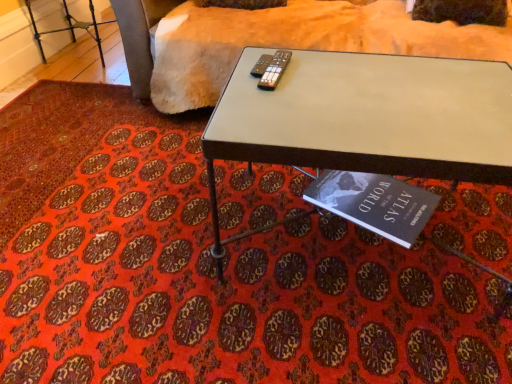
Find the location of `vacant area to the right of metallic silver remote at center`. vacant area to the right of metallic silver remote at center is located at coordinates (340, 68).